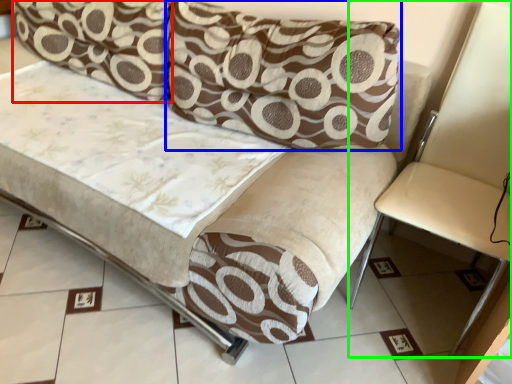
Question: Which is nearer to the pillow (highlighted by a red box)? pillow (highlighted by a blue box) or armchair (highlighted by a green box).

Choices:
 (A) pillow
 (B) armchair

Answer: (A)